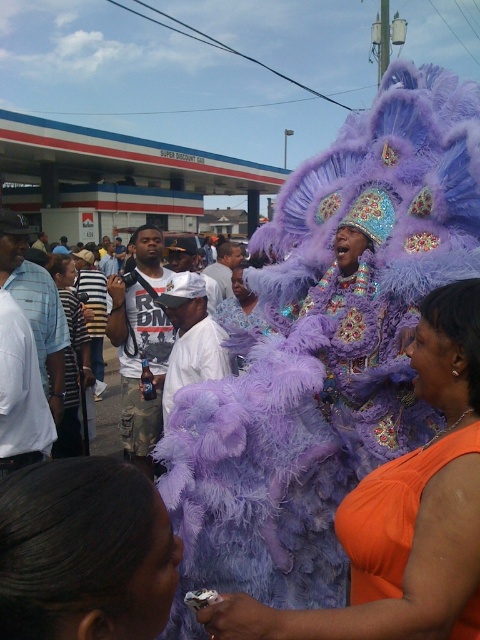
You are a photographer at the event and want to capture both the orange satin dress at center and the smooth purple feathered headdress at center in the same frame. Which object should you position closer to the left side of your camera viewfinder to ensure both are visible?

To ensure both the orange satin dress at center and the smooth purple feathered headdress at center are visible in the frame, position the smooth purple feathered headdress at center closer to the left side of the camera viewfinder since the orange satin dress at center is on its right side.

You are a photographer positioned at the origin point of the scene. You want to capture the smooth purple feathered headdress at center in your shot. Given that the camera has a focal length of 50mm and the sensor size is 24mm x 36mm, what is the minimum distance you need to be from the headdress to ensure it fills the frame vertically?

The smooth purple feathered headdress at center is located at point (84, 552). To calculate the minimum distance required, use the formula for field of view. However, without knowing the actual size of the headdress, an exact distance cannot be determined. Please provide the height of the headdress for an accurate calculation.

You are standing at the center of the street and see the point marked at coordinates [84,552]. Which object is this point located on?

The point marked at coordinates [84,552] is located on the smooth purple feathered headdress at center.